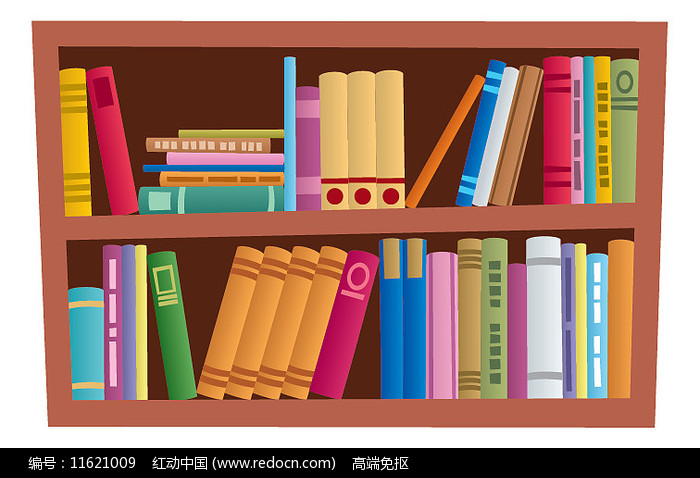
Find the location of `light brown colored thick shelves`. light brown colored thick shelves is located at coordinates (56, 219), (362, 35), (356, 216), (358, 417), (651, 192).